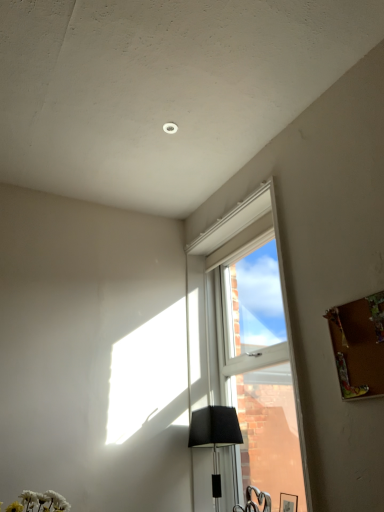
This screenshot has width=384, height=512. What do you see at coordinates (215, 436) in the screenshot?
I see `matte black lampshade at lower center` at bounding box center [215, 436].

What is the approximate height of matte black lampshade at lower center?

matte black lampshade at lower center is 24.11 inches in height.

I want to click on matte black lampshade at lower center, so tap(215, 436).

At what (x,y) coordinates should I click in order to perform the action: click on clear glass window at center. Please return your answer as a coordinate pair (x, y). Looking at the image, I should click on (247, 295).

This screenshot has width=384, height=512. What do you see at coordinates (247, 295) in the screenshot?
I see `clear glass window at center` at bounding box center [247, 295].

The width and height of the screenshot is (384, 512). What are the coordinates of `matte black lampshade at lower center` in the screenshot? It's located at (215, 436).

Considering the positions of objects matte black lampshade at lower center and clear glass window at center in the image provided, who is more to the left, matte black lampshade at lower center or clear glass window at center?

From the viewer's perspective, matte black lampshade at lower center appears more on the left side.

Between matte black lampshade at lower center and clear glass window at center, which one is positioned behind?

matte black lampshade at lower center is behind.

Is point (203, 440) closer or farther from the camera than point (219, 246)?

Point (203, 440) appears to be closer to the viewer than point (219, 246).

From the image's perspective, is matte black lampshade at lower center under clear glass window at center?

Indeed, from the image's perspective, matte black lampshade at lower center is shown beneath clear glass window at center.

Looking at this image, from a real-world perspective, is matte black lampshade at lower center above or below clear glass window at center?

matte black lampshade at lower center is below clear glass window at center.

Considering the relative sizes of matte black lampshade at lower center and clear glass window at center in the image provided, is matte black lampshade at lower center thinner than clear glass window at center?

In fact, matte black lampshade at lower center might be wider than clear glass window at center.

From their relative heights in the image, would you say matte black lampshade at lower center is taller or shorter than clear glass window at center?

Considering their sizes, matte black lampshade at lower center has less height than clear glass window at center.

Can you confirm if matte black lampshade at lower center is bigger than clear glass window at center?

Incorrect, matte black lampshade at lower center is not larger than clear glass window at center.

Is clear glass window at center a part of matte black lampshade at lower center?

No, clear glass window at center is located outside of matte black lampshade at lower center.

Is matte black lampshade at lower center next to clear glass window at center?

There is a gap between matte black lampshade at lower center and clear glass window at center.

Based on the photo, is matte black lampshade at lower center looking in the opposite direction of clear glass window at center?

Yes.

Can you tell me how much matte black lampshade at lower center and clear glass window at center differ in facing direction?

1.89 degrees separate the facing orientations of matte black lampshade at lower center and clear glass window at center.

Identify the location of lamp directly beneath the clear glass window at center (from a real-world perspective). This screenshot has height=512, width=384. (215, 436).

Which is more to the left, clear glass window at center or matte black lampshade at lower center?

From the viewer's perspective, matte black lampshade at lower center appears more on the left side.

Considering their positions, is clear glass window at center located in front of or behind matte black lampshade at lower center?

clear glass window at center is in front of matte black lampshade at lower center.

Is point (267, 188) positioned behind point (212, 444)?

No, (267, 188) is closer to viewer.

From the image's perspective, which is below, clear glass window at center or matte black lampshade at lower center?

matte black lampshade at lower center, from the image's perspective.

From a real-world perspective, is clear glass window at center positioned over matte black lampshade at lower center based on gravity?

Yes.

Which of these two, clear glass window at center or matte black lampshade at lower center, is wider?

Wider between the two is matte black lampshade at lower center.

Considering the relative sizes of clear glass window at center and matte black lampshade at lower center in the image provided, is clear glass window at center shorter than matte black lampshade at lower center?

In fact, clear glass window at center may be taller than matte black lampshade at lower center.

Considering the sizes of objects clear glass window at center and matte black lampshade at lower center in the image provided, who is smaller, clear glass window at center or matte black lampshade at lower center?

matte black lampshade at lower center.

Is matte black lampshade at lower center located within clear glass window at center?

No, matte black lampshade at lower center is located outside of clear glass window at center.

Is clear glass window at center positioned far away from matte black lampshade at lower center?

They are positioned close to each other.

Is clear glass window at center looking in the opposite direction of matte black lampshade at lower center?

That's right, clear glass window at center is facing away from matte black lampshade at lower center.

What's the angular difference between clear glass window at center and matte black lampshade at lower center's facing directions?

There is a 1.89-degree angle between the facing directions of clear glass window at center and matte black lampshade at lower center.

In order to click on lamp on the left of clear glass window at center in this screenshot , I will do `click(215, 436)`.

This screenshot has height=512, width=384. In the image, there is a clear glass window at center. What are the coordinates of `lamp below it (from a real-world perspective)` in the screenshot? It's located at (215, 436).

Locate an element on the screen. The image size is (384, 512). lamp below the clear glass window at center (from the image's perspective) is located at coordinates (215, 436).